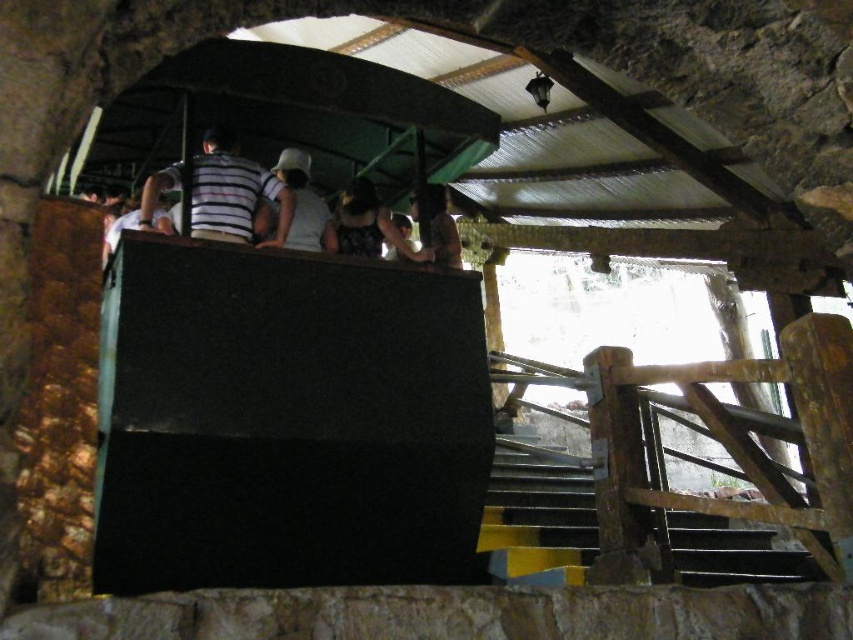
Question: Among these objects, which one is farthest from the camera?

Choices:
 (A) matte black shirt at upper center
 (B) metallic gray stairs at lower right

Answer: (A)

Question: Can you confirm if metallic gray stairs at lower right is bigger than striped fabric shirt at upper center?

Choices:
 (A) no
 (B) yes

Answer: (B)

Question: Can you confirm if striped fabric shirt at upper center is positioned to the left of white matte hat at upper center?

Choices:
 (A) no
 (B) yes

Answer: (B)

Question: Estimate the real-world distances between objects in this image. Which object is closer to the striped fabric shirt at upper center?

Choices:
 (A) white matte hat at upper center
 (B) metallic gray stairs at lower right
 (C) matte black shirt at upper center
 (D) dark brown leather jacket at upper center

Answer: (A)

Question: Does metallic gray stairs at lower right appear on the left side of striped fabric shirt at upper center?

Choices:
 (A) no
 (B) yes

Answer: (A)

Question: Considering the real-world distances, which object is farthest from the metallic gray stairs at lower right?

Choices:
 (A) white matte hat at upper center
 (B) striped fabric shirt at upper center
 (C) dark brown leather jacket at upper center
 (D) matte black shirt at upper center

Answer: (B)